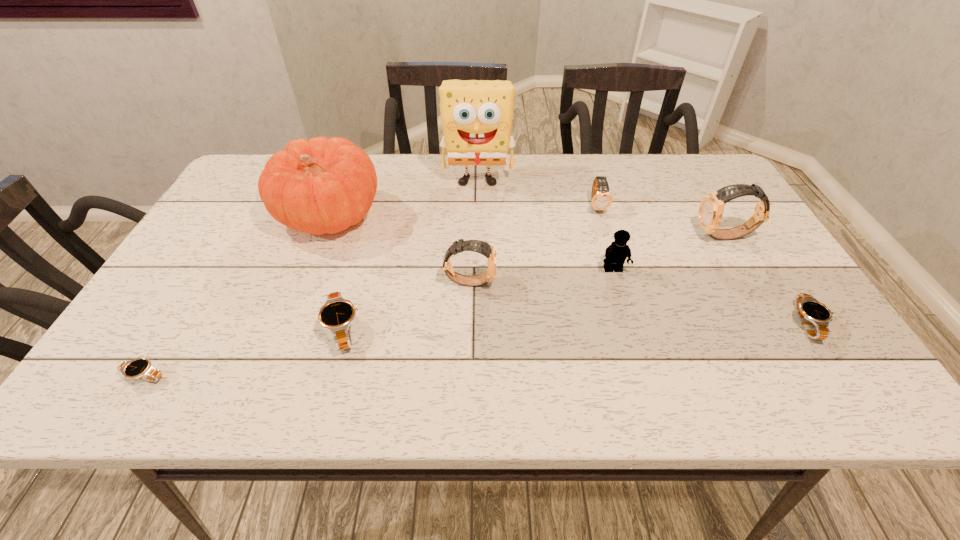
This screenshot has height=540, width=960. I want to click on vacant area between the orange pumpkin and the nearest watch, so click(237, 297).

The width and height of the screenshot is (960, 540). Find the location of `free space between the yellow sponge and the second smallest black watch`. free space between the yellow sponge and the second smallest black watch is located at coordinates (642, 251).

This screenshot has height=540, width=960. I want to click on free space between the tallest watch and the Lego, so coord(669,253).

You are a GUI agent. You are given a task and a screenshot of the screen. Output one action in this format:
    pyautogui.click(x=<x>, y=<y>)
    Task: Click on the unoccupied position between the leftmost gold watch and the yellow sponge
    
    Given the screenshot: What is the action you would take?
    pyautogui.click(x=473, y=230)

The width and height of the screenshot is (960, 540). I want to click on empty space between the farthest watch and the second shortest object, so click(702, 265).

The height and width of the screenshot is (540, 960). I want to click on object that is the closest to the second tallest object, so click(476, 115).

Choose which object is the nearest neighbor to the leftmost black watch. Please provide its 2D coordinates. Your answer should be formatted as a tuple, i.e. [(x, y)], where the tuple contains the x and y coordinates of a point satisfying the conditions above.

[(337, 314)]

Identify which watch is located as the fifth nearest to the third farthest watch. Please provide its 2D coordinates. Your answer should be formatted as a tuple, i.e. [(x, y)], where the tuple contains the x and y coordinates of a point satisfying the conditions above.

[(808, 309)]

Identify which watch is the third nearest to the second tallest watch. Please provide its 2D coordinates. Your answer should be formatted as a tuple, i.e. [(x, y)], where the tuple contains the x and y coordinates of a point satisfying the conditions above.

[(710, 212)]

Find the location of `the second closest gold watch to the sponge`. the second closest gold watch to the sponge is located at coordinates (484, 248).